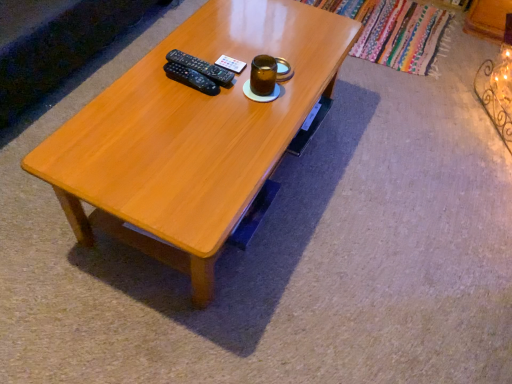
You are a GUI agent. You are given a task and a screenshot of the screen. Output one action in this format:
    pyautogui.click(x=<x>, y=<y>)
    Task: Click on the vacant area to the right of black plastic remote at center
    Image resolution: width=512 pixels, height=384 pixels.
    Given the screenshot: What is the action you would take?
    pyautogui.click(x=250, y=71)